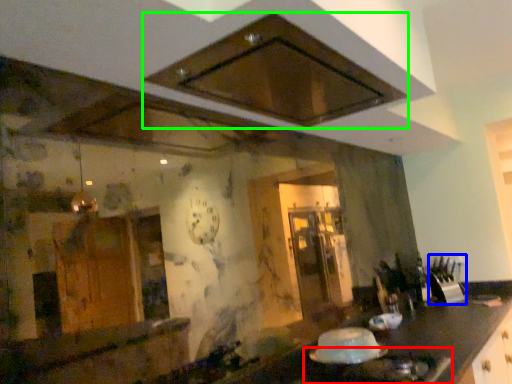
Question: Which object is the farthest from gas stove (highlighted by a red box)? Choose among these: appliance (highlighted by a blue box) or exhaust hood (highlighted by a green box).

Choices:
 (A) appliance
 (B) exhaust hood

Answer: (A)